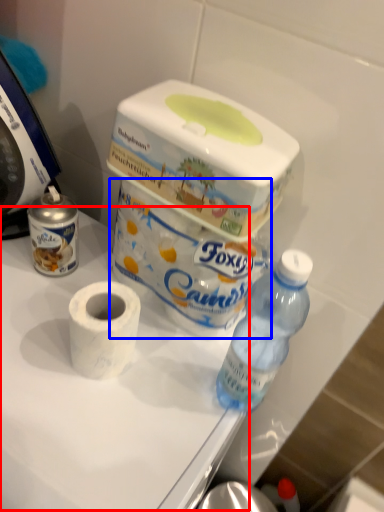
Question: Which object appears closest to the camera in this image, table (highlighted by a red box) or toilet paper (highlighted by a blue box)?

Choices:
 (A) table
 (B) toilet paper

Answer: (A)